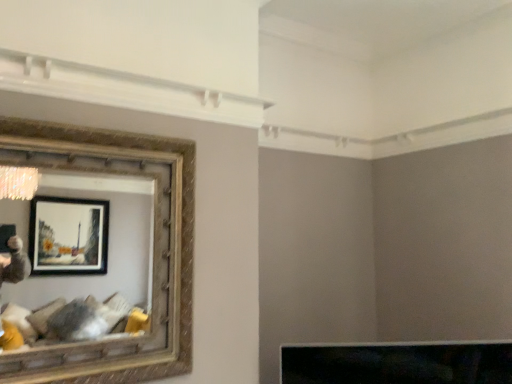
The width and height of the screenshot is (512, 384). What do you see at coordinates (398, 363) in the screenshot? I see `black glossy tv at lower center` at bounding box center [398, 363].

Where is `black glossy tv at lower center`? Image resolution: width=512 pixels, height=384 pixels. black glossy tv at lower center is located at coordinates (398, 363).

Locate an element on the screen. The height and width of the screenshot is (384, 512). gold textured picture frame at left is located at coordinates (153, 232).

What do you see at coordinates (153, 232) in the screenshot?
I see `gold textured picture frame at left` at bounding box center [153, 232].

Identify the location of black glossy tv at lower center. The height and width of the screenshot is (384, 512). (398, 363).

In the image, is gold textured picture frame at left on the left side or the right side of black glossy tv at lower center?

Clearly, gold textured picture frame at left is on the left of black glossy tv at lower center in the image.

Which is behind, gold textured picture frame at left or black glossy tv at lower center?

black glossy tv at lower center is further away from the camera.

Which is closer, (187, 314) or (409, 343)?

The point (187, 314) is closer to the camera.

From the image's perspective, between gold textured picture frame at left and black glossy tv at lower center, who is located below?

black glossy tv at lower center, from the image's perspective.

From a real-world perspective, who is located higher, gold textured picture frame at left or black glossy tv at lower center?

From a 3D spatial view, gold textured picture frame at left is above.

Which object is thinner, gold textured picture frame at left or black glossy tv at lower center?

Thinner between the two is gold textured picture frame at left.

Considering the sizes of objects gold textured picture frame at left and black glossy tv at lower center in the image provided, who is shorter, gold textured picture frame at left or black glossy tv at lower center?

With less height is black glossy tv at lower center.

Considering the sizes of objects gold textured picture frame at left and black glossy tv at lower center in the image provided, who is smaller, gold textured picture frame at left or black glossy tv at lower center?

With smaller size is black glossy tv at lower center.

Is black glossy tv at lower center surrounded by gold textured picture frame at left?

No, black glossy tv at lower center is located outside of gold textured picture frame at left.

Would you consider gold textured picture frame at left to be distant from black glossy tv at lower center?

Actually, gold textured picture frame at left and black glossy tv at lower center are a little close together.

Looking at this image, is gold textured picture frame at left looking in the opposite direction of black glossy tv at lower center?

No, black glossy tv at lower center is not at the back of gold textured picture frame at left.

What's the angular difference between gold textured picture frame at left and black glossy tv at lower center's facing directions?

The angular difference between gold textured picture frame at left and black glossy tv at lower center is 29.3 degrees.

Locate an element on the screen. The width and height of the screenshot is (512, 384). picture frame above the black glossy tv at lower center (from a real-world perspective) is located at coordinates (153, 232).

Consider the image. Which is more to the right, black glossy tv at lower center or gold textured picture frame at left?

black glossy tv at lower center is more to the right.

In the scene shown: Considering the positions of objects black glossy tv at lower center and gold textured picture frame at left in the image provided, who is behind, black glossy tv at lower center or gold textured picture frame at left?

black glossy tv at lower center is behind.

Which is in front, point (445, 348) or point (165, 206)?

The point (165, 206) is closer.

From the image's perspective, who appears lower, black glossy tv at lower center or gold textured picture frame at left?

From the image's view, black glossy tv at lower center is below.

From a real-world perspective, does black glossy tv at lower center stand above gold textured picture frame at left?

No.

Is black glossy tv at lower center thinner than gold textured picture frame at left?

In fact, black glossy tv at lower center might be wider than gold textured picture frame at left.

Considering the relative sizes of black glossy tv at lower center and gold textured picture frame at left in the image provided, is black glossy tv at lower center taller than gold textured picture frame at left?

No, black glossy tv at lower center is not taller than gold textured picture frame at left.

Based on their sizes in the image, would you say black glossy tv at lower center is bigger or smaller than gold textured picture frame at left?

In the image, black glossy tv at lower center appears to be smaller than gold textured picture frame at left.

Is black glossy tv at lower center completely or partially outside of gold textured picture frame at left?

Indeed, black glossy tv at lower center is completely outside gold textured picture frame at left.

Are black glossy tv at lower center and gold textured picture frame at left making contact?

black glossy tv at lower center and gold textured picture frame at left are not in contact.

Is black glossy tv at lower center oriented away from gold textured picture frame at left?

No, black glossy tv at lower center is not facing away from gold textured picture frame at left.

Can you tell me how much black glossy tv at lower center and gold textured picture frame at left differ in facing direction?

The angle between the facing direction of black glossy tv at lower center and the facing direction of gold textured picture frame at left is 29.3 degrees.

Where is `furniture behind the gold textured picture frame at left`? furniture behind the gold textured picture frame at left is located at coordinates (398, 363).

Where is `furniture that is below the gold textured picture frame at left (from the image's perspective)`? furniture that is below the gold textured picture frame at left (from the image's perspective) is located at coordinates (398, 363).

What are the coordinates of `picture frame above the black glossy tv at lower center (from a real-world perspective)` in the screenshot? It's located at point(153,232).